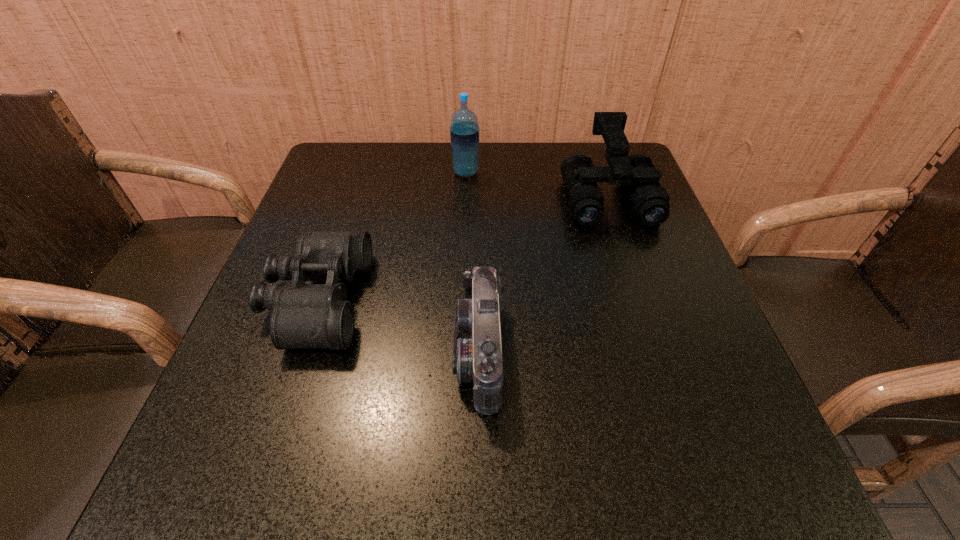
In order to click on free location located on the front-facing side of the camcorder in this screenshot , I will do `click(391, 353)`.

Where is `vacant space located at the eyepieces of the shorter binoculars`? vacant space located at the eyepieces of the shorter binoculars is located at coordinates (390, 300).

At what (x,y) coordinates should I click in order to perform the action: click on water bottle located in the far edge section of the desktop. Please return your answer as a coordinate pair (x, y). The height and width of the screenshot is (540, 960). Looking at the image, I should click on (464, 131).

At what (x,y) coordinates should I click in order to perform the action: click on binoculars situated at the far edge. Please return your answer as a coordinate pair (x, y). Looking at the image, I should click on (650, 202).

Where is `object that is at the left edge`? The width and height of the screenshot is (960, 540). object that is at the left edge is located at coordinates (304, 315).

You are a GUI agent. You are given a task and a screenshot of the screen. Output one action in this format:
    pyautogui.click(x=<x>, y=<y>)
    Task: Click on the object at the right edge
    This screenshot has width=960, height=540.
    Given the screenshot: What is the action you would take?
    pyautogui.click(x=650, y=202)

Where is `object located in the far right corner section of the desktop`? The height and width of the screenshot is (540, 960). object located in the far right corner section of the desktop is located at coordinates (650, 202).

Find the location of `vacant region at the far edge of the desktop`. vacant region at the far edge of the desktop is located at coordinates (452, 183).

This screenshot has width=960, height=540. In the image, there is a desktop. What are the coordinates of `vacant space at the near edge` in the screenshot? It's located at (572, 445).

The width and height of the screenshot is (960, 540). In the image, there is a desktop. In order to click on blank space at the left edge in this screenshot , I will do `click(264, 438)`.